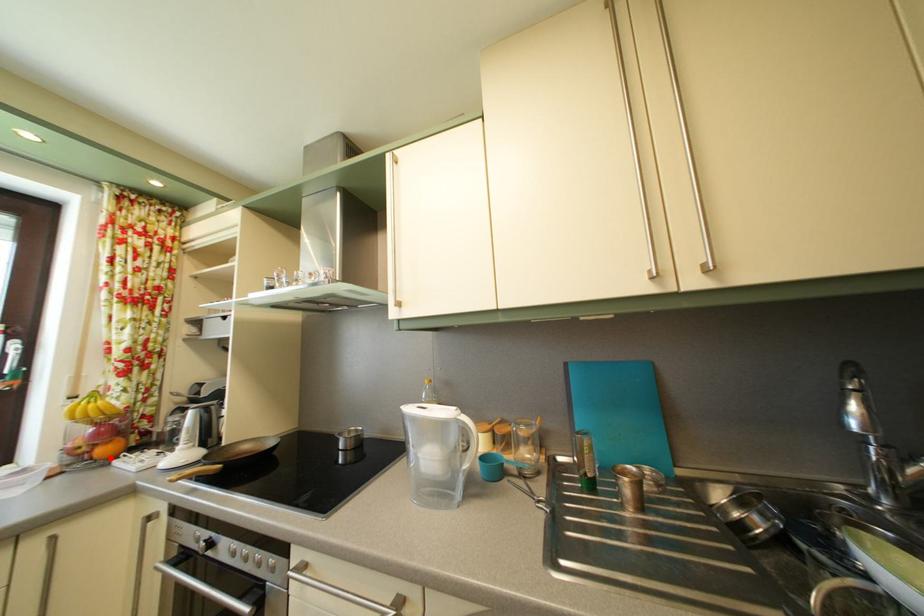
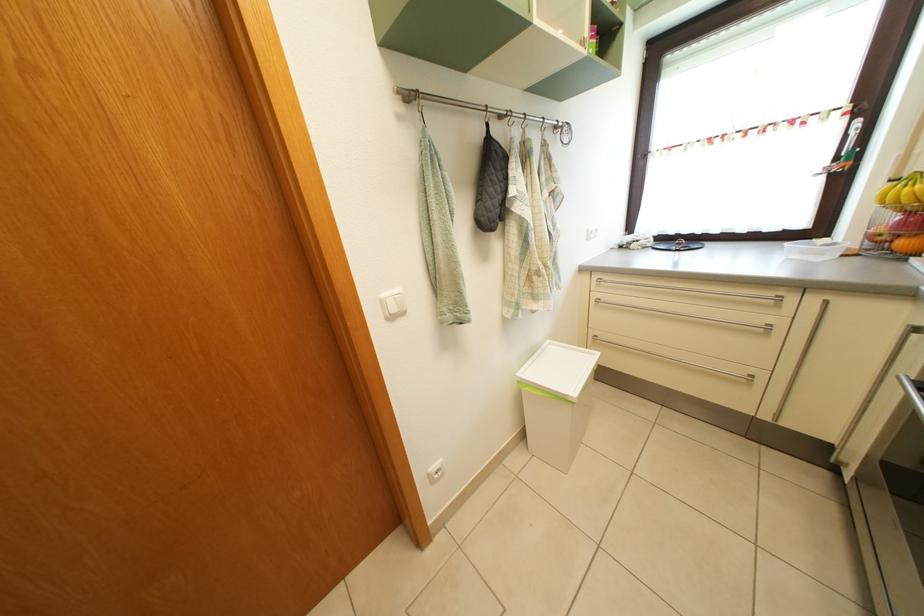
In the second image, find the point that corresponds to the highlighted location in the first image.

(910, 252)